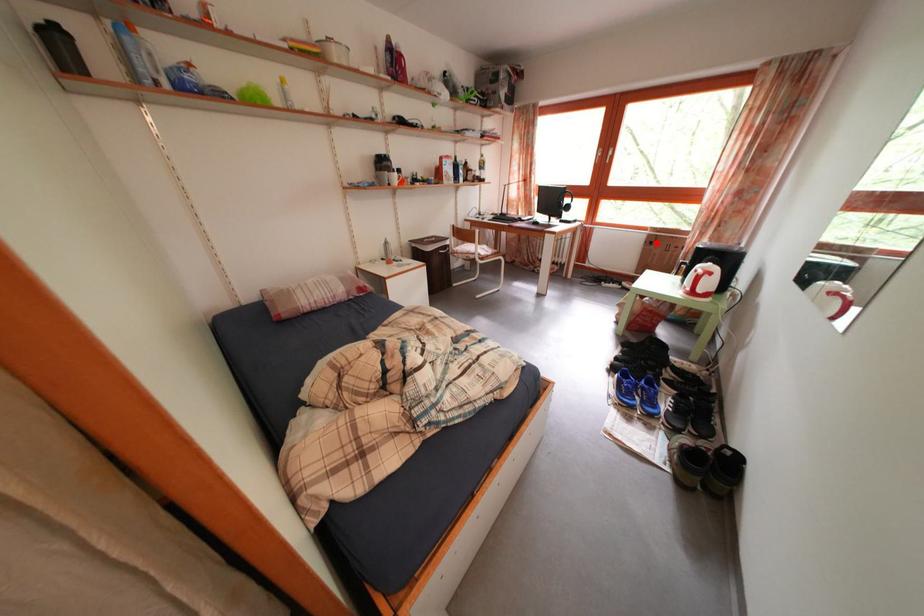
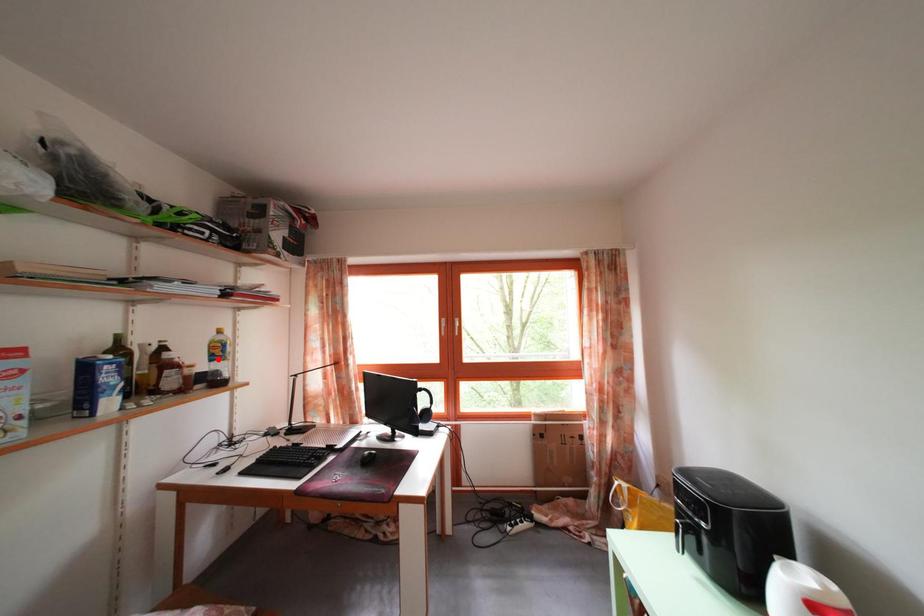
I am providing you with two images of the same scene from different viewpoints. A red point is marked on the first image and another point is marked on the second image. Is the marked point in image1 the same physical position as the marked point in image2?

No